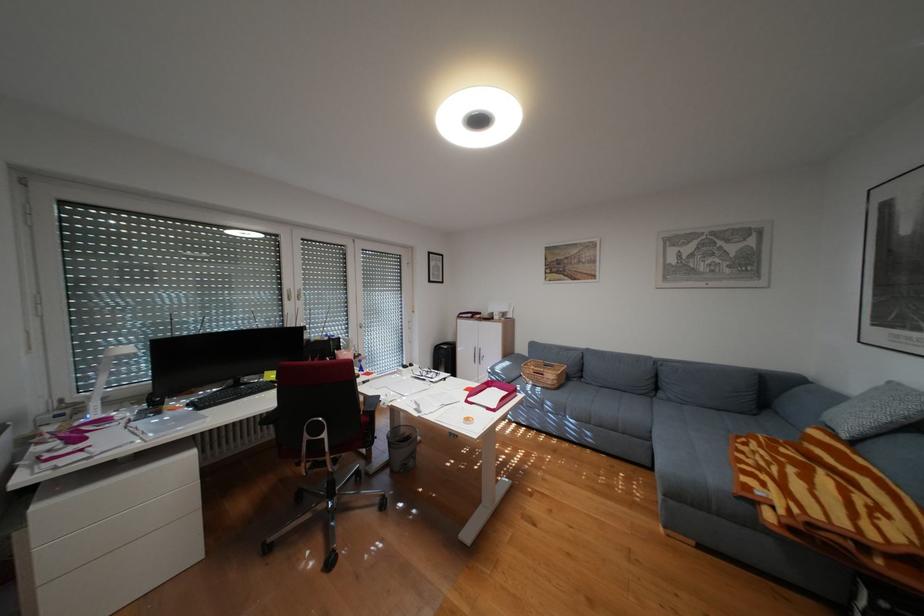
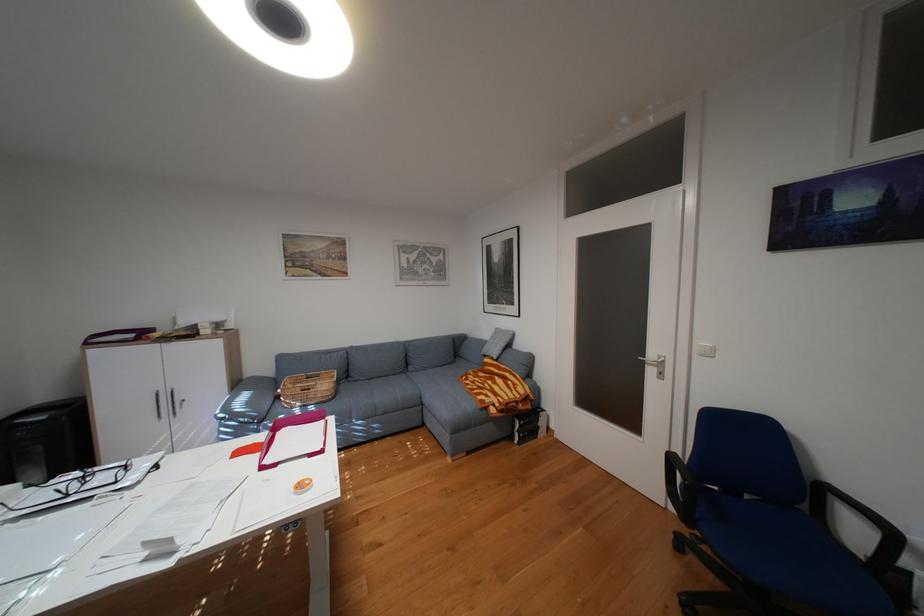
Find the pixel in the second image that matches (682,399) in the first image.

(430, 370)